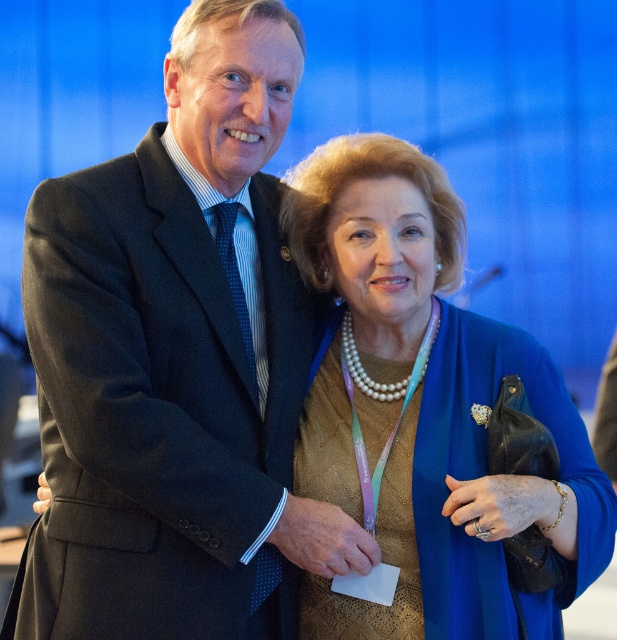
Question: Considering the relative positions of pearl necklace at center and blue dotted tie at center in the image provided, where is pearl necklace at center located with respect to blue dotted tie at center?

Choices:
 (A) left
 (B) right

Answer: (B)

Question: Does dark gray suit at center appear on the right side of pearl necklace at center?

Choices:
 (A) yes
 (B) no

Answer: (B)

Question: Which object is the farthest from the dark gray suit at center?

Choices:
 (A) pearl necklace at center
 (B) blue dotted tie at center

Answer: (A)

Question: Which is farther from the pearl necklace at center?

Choices:
 (A) blue dotted tie at center
 (B) dark gray suit at center

Answer: (A)

Question: Estimate the real-world distances between objects in this image. Which object is closer to the blue dotted tie at center?

Choices:
 (A) pearl necklace at center
 (B) dark gray suit at center

Answer: (B)

Question: Is dark gray suit at center further to camera compared to pearl necklace at center?

Choices:
 (A) yes
 (B) no

Answer: (B)